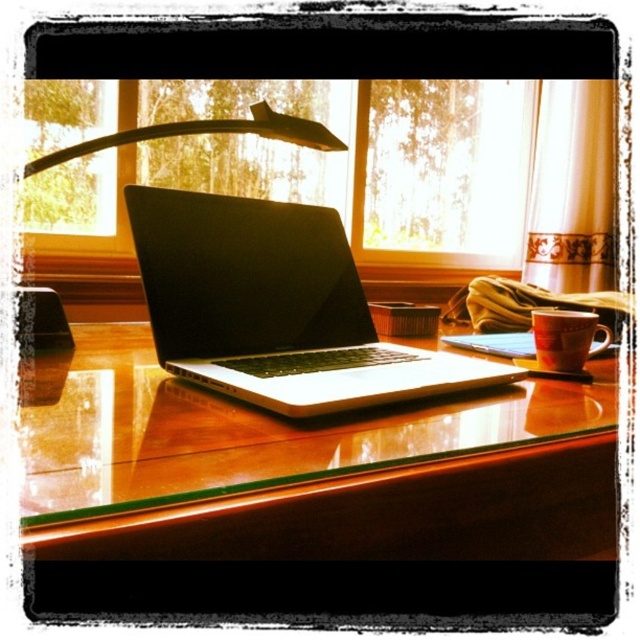
Is glossy wood table at center positioned in front of sleek silver laptop at center?

Yes, it is.

Is glossy wood table at center wider than sleek silver laptop at center?

Yes, glossy wood table at center is wider than sleek silver laptop at center.

Which is behind, point (129, 368) or point (305, 248)?

The point (305, 248) is behind.

Where is `glossy wood table at center`? glossy wood table at center is located at coordinates (308, 467).

Is transparent glass window at center to the left of black plastic lamp at upper center from the viewer's perspective?

In fact, transparent glass window at center is to the right of black plastic lamp at upper center.

How far apart are transparent glass window at center and black plastic lamp at upper center?

A distance of 3.28 feet exists between transparent glass window at center and black plastic lamp at upper center.

Describe the element at coordinates (332, 166) in the screenshot. I see `transparent glass window at center` at that location.

Where is `transparent glass window at center`? Image resolution: width=640 pixels, height=640 pixels. transparent glass window at center is located at coordinates pyautogui.click(x=332, y=166).

Can you confirm if transparent glass window at center is bigger than sleek silver laptop at center?

Yes.

Does transparent glass window at center have a lesser width compared to sleek silver laptop at center?

Incorrect, transparent glass window at center's width is not less than sleek silver laptop at center's.

Measure the distance between point (464,260) and camera.

Point (464,260) is 7.09 feet from camera.

Find the location of `transparent glass window at center`. transparent glass window at center is located at coordinates (332, 166).